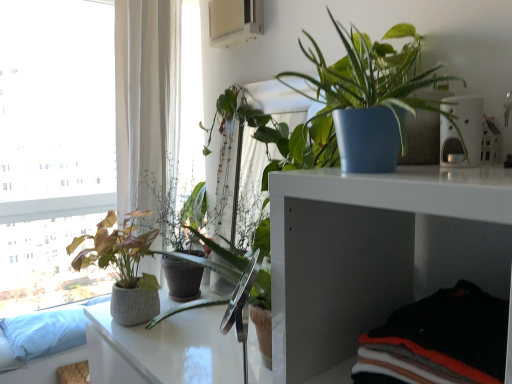
Question: Can you confirm if blue fabric couch at lower left is thinner than textured gray pot at left, the second houseplant positioned from the front?

Choices:
 (A) yes
 (B) no

Answer: (B)

Question: Would you say blue fabric couch at lower left contains textured gray pot at left, the second houseplant positioned from the front?

Choices:
 (A) no
 (B) yes

Answer: (A)

Question: Is blue fabric couch at lower left to the right of textured gray pot at left, the second houseplant when ordered from right to left, from the viewer's perspective?

Choices:
 (A) yes
 (B) no

Answer: (B)

Question: Considering the relative sizes of blue fabric couch at lower left and textured gray pot at left, marked as the second houseplant in a top-to-bottom arrangement, in the image provided, is blue fabric couch at lower left taller than textured gray pot at left, marked as the second houseplant in a top-to-bottom arrangement,?

Choices:
 (A) yes
 (B) no

Answer: (B)

Question: Is there a large distance between blue fabric couch at lower left and textured gray pot at left, the second houseplant when ordered from right to left?

Choices:
 (A) yes
 (B) no

Answer: (A)

Question: In terms of height, does white glass window at left look taller or shorter compared to white plastic pet feeder at upper right?

Choices:
 (A) short
 (B) tall

Answer: (B)

Question: From a real-world perspective, is white glass window at left positioned above or below white plastic pet feeder at upper right?

Choices:
 (A) above
 (B) below

Answer: (B)

Question: Looking at their shapes, would you say white glass window at left is wider or thinner than white plastic pet feeder at upper right?

Choices:
 (A) wide
 (B) thin

Answer: (A)

Question: Visually, is white glass window at left positioned to the left or to the right of white plastic pet feeder at upper right?

Choices:
 (A) right
 (B) left

Answer: (B)

Question: Is point click(442, 127) closer or farther from the camera than point click(175, 331)?

Choices:
 (A) closer
 (B) farther

Answer: (A)

Question: Choose the correct answer: Is white plastic pet feeder at upper right inside white glossy table at center or outside it?

Choices:
 (A) inside
 (B) outside

Answer: (B)

Question: From a real-world perspective, is white plastic pet feeder at upper right positioned above or below white glossy table at center?

Choices:
 (A) below
 (B) above

Answer: (B)

Question: Considering the positions of white plastic pet feeder at upper right and white glossy table at center in the image, is white plastic pet feeder at upper right wider or thinner than white glossy table at center?

Choices:
 (A) thin
 (B) wide

Answer: (A)

Question: Would you say white glass window at left is to the left or to the right of textured gray pot at left, positioned as the 1th houseplant in back-to-front order, in the picture?

Choices:
 (A) left
 (B) right

Answer: (A)

Question: From a real-world perspective, is white glass window at left above or below textured gray pot at left, the second houseplant positioned from the front?

Choices:
 (A) above
 (B) below

Answer: (A)